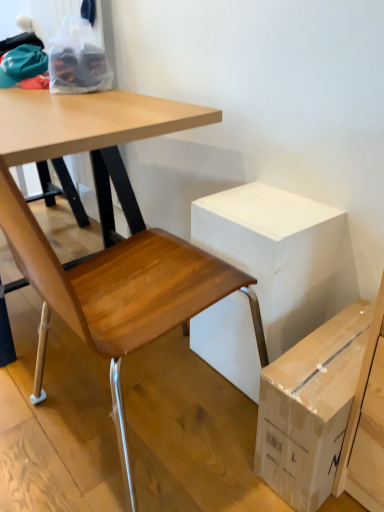
You are a GUI agent. You are given a task and a screenshot of the screen. Output one action in this format:
    pyautogui.click(x=<x>, y=<y>)
    Task: Click on the free space in front of white cardboard box at center
    This screenshot has width=384, height=512.
    Given the screenshot: What is the action you would take?
    pyautogui.click(x=208, y=425)